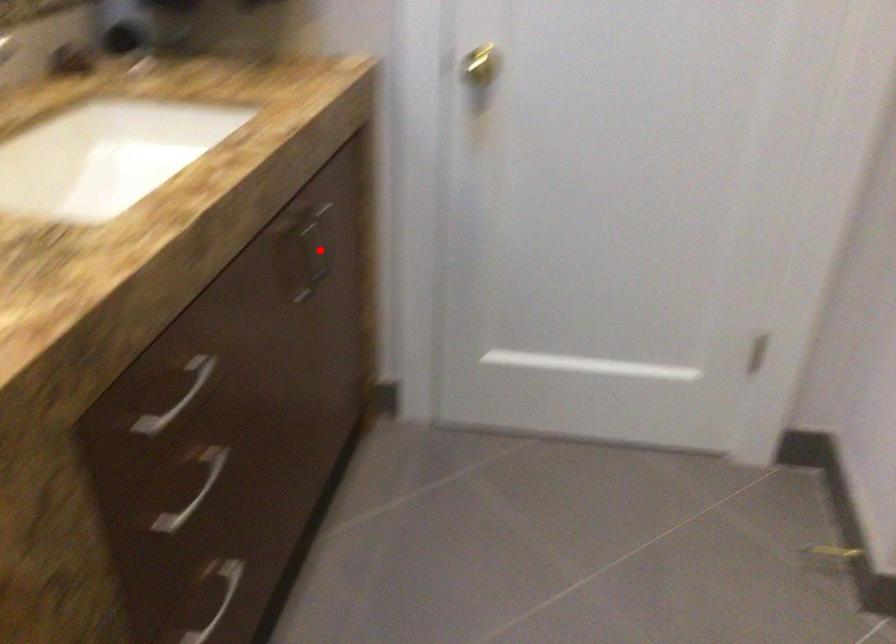
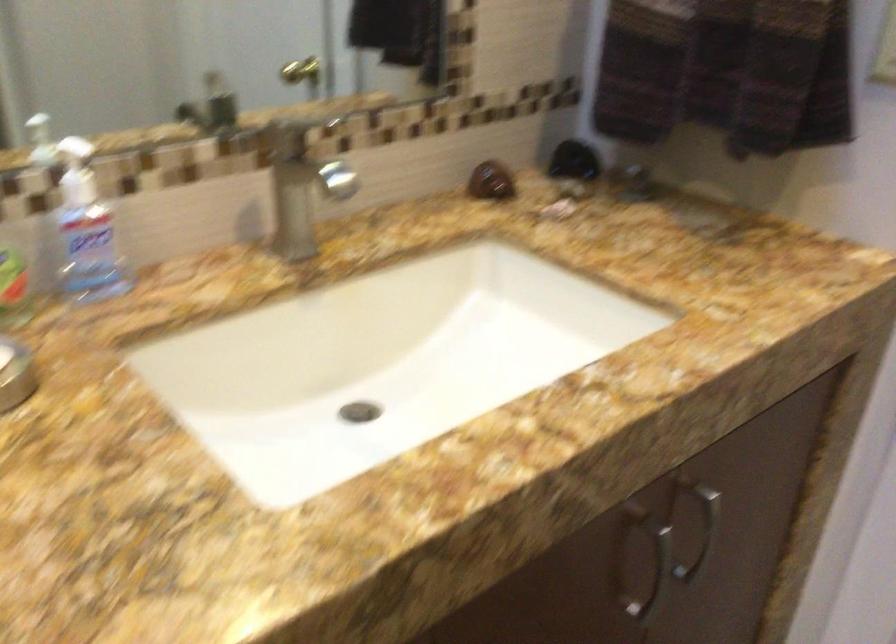
Question: I am providing you with two images of the same scene from different viewpoints. Image1 has a red point marked. In image2, the corresponding 3D location appears at what relative position? Reply with the corresponding letter.

Choices:
 (A) Closer
 (B) Farther

Answer: (A)